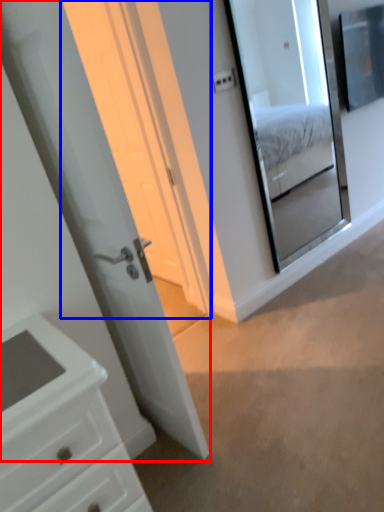
Question: Among these objects, which one is farthest to the camera, door (highlighted by a red box) or screen door (highlighted by a blue box)?

Choices:
 (A) door
 (B) screen door

Answer: (B)